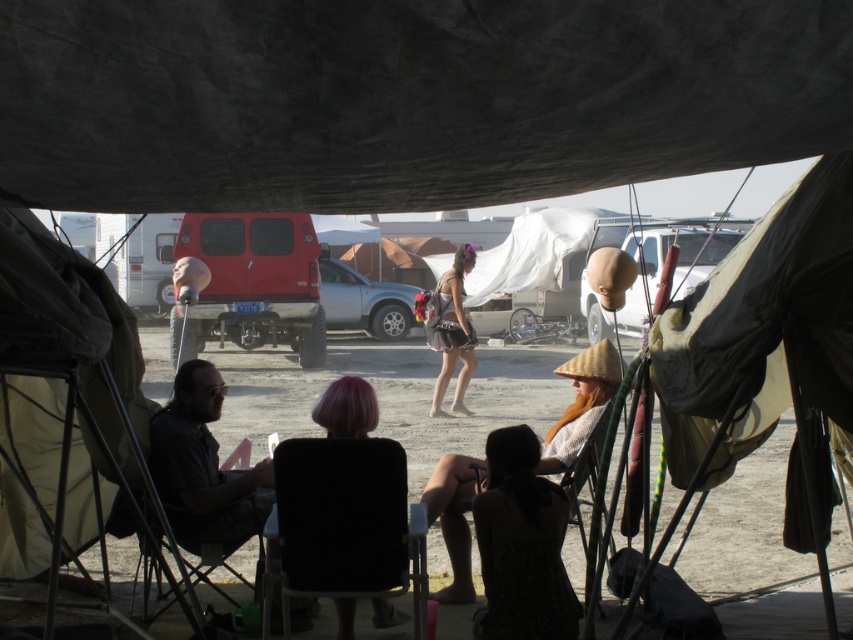
Does point (489, 627) lie in front of point (444, 512)?

Yes.

Measure the distance between point [541,637] and camera.

They are 4.80 meters apart.

Which is in front, point (508, 621) or point (611, 392)?

Point (508, 621)

This screenshot has height=640, width=853. I want to click on dark brown fabric dress at lower center, so pyautogui.click(x=521, y=545).

In the scene shown: Who is taller, dark brown fabric dress at lower center or silky pink hair at center?

With more height is dark brown fabric dress at lower center.

Identify the location of dark brown fabric dress at lower center. This screenshot has width=853, height=640. (521, 545).

Who is taller, dark gray shirt at left or beige straw hat at center?

With more height is dark gray shirt at left.

Is dark gray shirt at left smaller than beige straw hat at center?

No.

Which is in front, point (216, 401) or point (576, 444)?

Point (216, 401)

In order to click on dark gray shirt at left in this screenshot , I will do `click(202, 465)`.